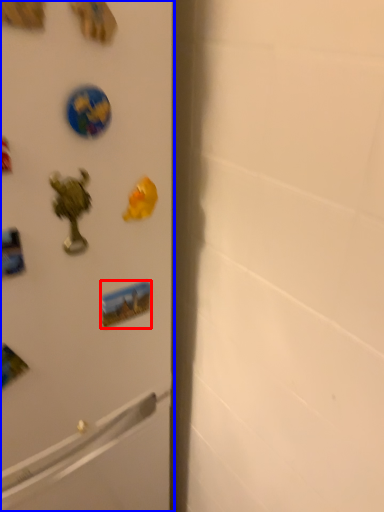
Question: Which object is further to the camera taking this photo, sticker (highlighted by a red box) or refrigerator (highlighted by a blue box)?

Choices:
 (A) sticker
 (B) refrigerator

Answer: (A)